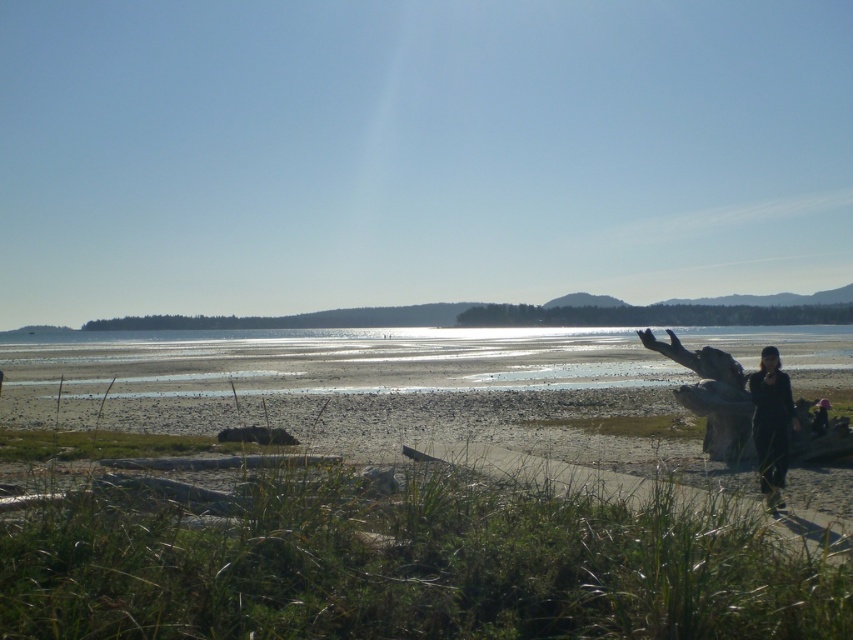
Based on the photo, who is higher up, smooth sand beach at lower right or black matte clothing at lower right?

black matte clothing at lower right is above.

Does smooth sand beach at lower right have a greater width compared to black matte clothing at lower right?

Indeed, smooth sand beach at lower right has a greater width compared to black matte clothing at lower right.

Is point (390, 420) more distant than point (787, 413)?

Yes, it is.

The image size is (853, 640). In order to click on smooth sand beach at lower right in this screenshot , I will do `click(361, 388)`.

Can you confirm if smooth sand beach at lower right is bigger than clear sand at lower center?

No, smooth sand beach at lower right is not bigger than clear sand at lower center.

Is point (805, 372) in front of point (640, 364)?

Yes, it is in front of point (640, 364).

Locate an element on the screen. The height and width of the screenshot is (640, 853). smooth sand beach at lower right is located at coordinates (361, 388).

How far apart are clear sand at lower center and black matte clothing at lower right?

The distance of clear sand at lower center from black matte clothing at lower right is 260.04 feet.

Describe the element at coordinates (340, 362) in the screenshot. This screenshot has width=853, height=640. I see `clear sand at lower center` at that location.

This screenshot has height=640, width=853. I want to click on clear sand at lower center, so click(340, 362).